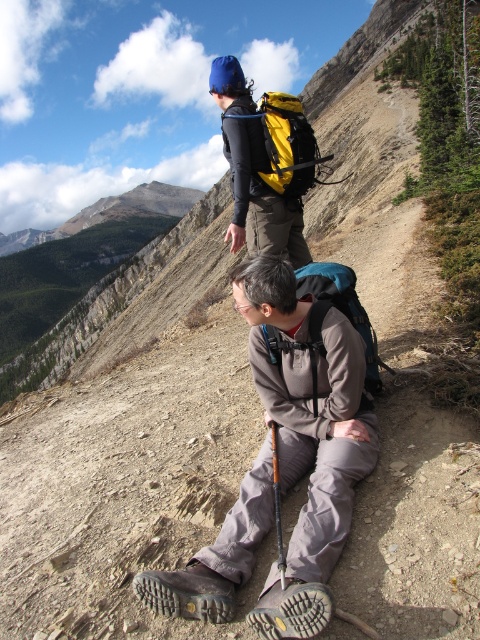
Question: Is the position of gray fabric backpack at center more distant than that of teal fabric backpack at center?

Choices:
 (A) no
 (B) yes

Answer: (A)

Question: Does teal fabric backpack at center come in front of yellow fabric backpack at upper center?

Choices:
 (A) yes
 (B) no

Answer: (A)

Question: Which object is positioned closest to the yellow fabric backpack at upper center?

Choices:
 (A) gray fabric backpack at center
 (B) teal fabric backpack at center

Answer: (B)

Question: Which object is positioned closest to the gray fabric backpack at center?

Choices:
 (A) teal fabric backpack at center
 (B) yellow fabric backpack at upper center

Answer: (A)

Question: Considering the real-world distances, which object is farthest from the teal fabric backpack at center?

Choices:
 (A) yellow fabric backpack at upper center
 (B) gray fabric backpack at center

Answer: (A)

Question: Can you confirm if teal fabric backpack at center is smaller than yellow fabric backpack at upper center?

Choices:
 (A) no
 (B) yes

Answer: (B)